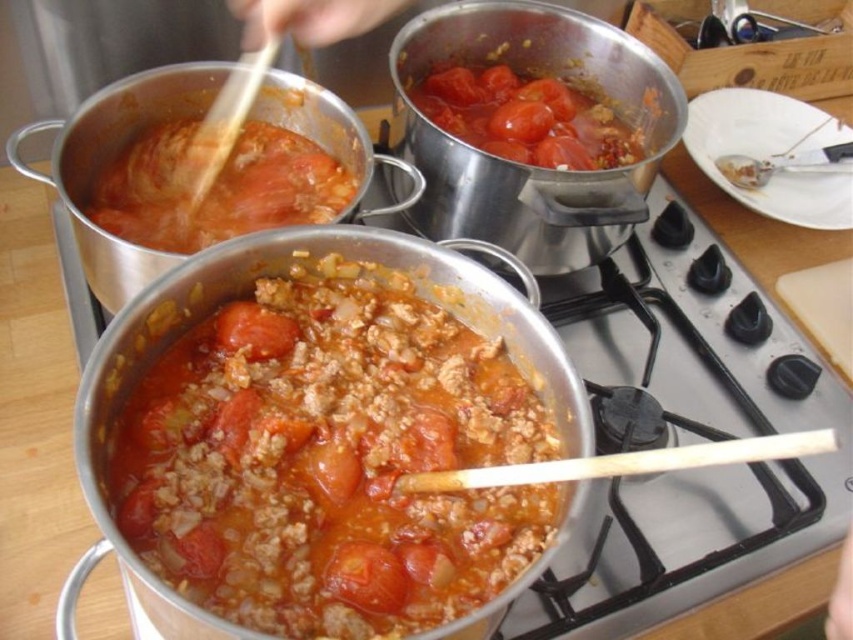
Question: Does tomatoey paste at center appear on the right side of tomato-based sauce at center?

Choices:
 (A) yes
 (B) no

Answer: (A)

Question: Can you confirm if tomatoey paste at center is positioned to the left of red matte tomato at center?

Choices:
 (A) yes
 (B) no

Answer: (B)

Question: Based on their relative distances, which object is nearer to the tomatoey paste at center?

Choices:
 (A) stainless steel gas stove at center
 (B) red matte tomato at center
 (C) tomato-based sauce at center

Answer: (B)

Question: Among these objects, which one is farthest from the camera?

Choices:
 (A) tomato-based sauce at center
 (B) red matte tomato at center
 (C) stainless steel gas stove at center
 (D) tomatoey paste at center

Answer: (A)

Question: Which point is closer to the camera?

Choices:
 (A) red matte tomato at center
 (B) tomatoey paste at center

Answer: (B)

Question: From the image, what is the correct spatial relationship of tomatoey paste at center in relation to red matte tomato at center?

Choices:
 (A) right
 (B) left

Answer: (A)